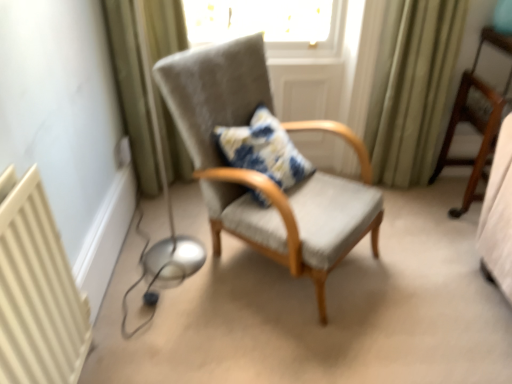
Question: Is wooden chair at right, which is the 2th chair in left-to-right order, inside the boundaries of textured gray armchair at center, the second chair viewed from the right, or outside?

Choices:
 (A) inside
 (B) outside

Answer: (B)

Question: Looking at their shapes, would you say wooden chair at right, which is counted as the first chair, starting from the right, is wider or thinner than textured gray armchair at center, the second chair viewed from the right?

Choices:
 (A) wide
 (B) thin

Answer: (B)

Question: Which is farther from the white plastic electric outlet at lower left?

Choices:
 (A) green fabric curtain at left, which ranks as the 2th curtain in right-to-left order
 (B) blue and white tie-dye pillow at center
 (C) textured gray armchair at center, the second chair viewed from the right
 (D) green fabric curtain at right, which is the second curtain from left to right
 (E) wooden chair at right, which is counted as the first chair, starting from the right

Answer: (E)

Question: Which object is positioned farthest from the blue and white tie-dye pillow at center?

Choices:
 (A) wooden chair at right, which is the 2th chair in left-to-right order
 (B) green fabric curtain at right, which is the 1th curtain in right-to-left order
 (C) textured gray armchair at center, marked as the 1th chair in a left-to-right arrangement
 (D) white plastic electric outlet at lower left
 (E) green fabric curtain at left, arranged as the 1th curtain when viewed from the left

Answer: (A)